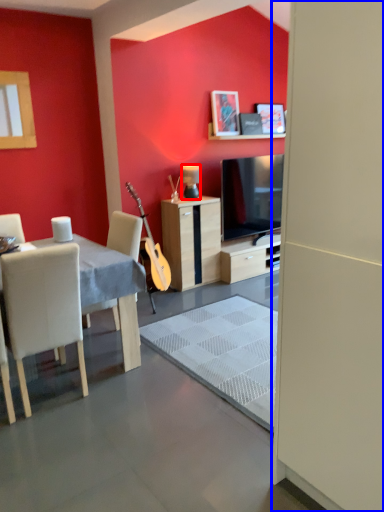
Question: Which of the following is the farthest to the observer, lamp (highlighted by a red box) or screen door (highlighted by a blue box)?

Choices:
 (A) lamp
 (B) screen door

Answer: (A)